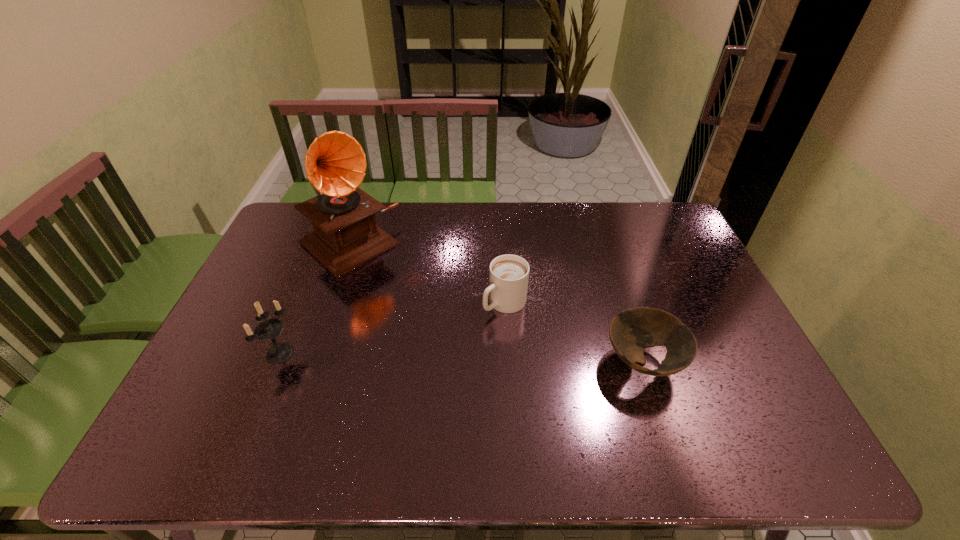
The width and height of the screenshot is (960, 540). What are the coordinates of `vacant space on the desktop that is between the candle holder and the bowl and is positioned on the side with the handle of the cappuccino` in the screenshot? It's located at (442, 357).

Identify the location of vacant space on the desktop that is between the candle holder and the rightmost object and is positioned on the horn of the farthest object. Image resolution: width=960 pixels, height=540 pixels. (485, 358).